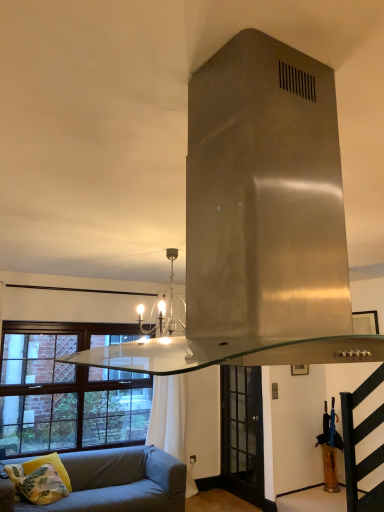
Question: From the image's perspective, is clear glass door at center positioned above or below yellow fabric pillow at lower left, arranged as the second pillow when viewed from the left?

Choices:
 (A) above
 (B) below

Answer: (B)

Question: From a real-world perspective, is clear glass door at center positioned above or below yellow fabric pillow at lower left, which is the first pillow from right to left?

Choices:
 (A) above
 (B) below

Answer: (A)

Question: Which of these objects is positioned farthest from the clear glass door at center?

Choices:
 (A) light blue fabric studio couch at lower left
 (B) brown wooden window at lower left
 (C) matte black chandelier at center
 (D) yellow floral pillow at lower left, marked as the 1th pillow in a left-to-right arrangement
 (E) yellow fabric pillow at lower left, arranged as the second pillow when viewed from the left

Answer: (D)

Question: Which object is the closest to the brown wooden window at lower left?

Choices:
 (A) light blue fabric studio couch at lower left
 (B) matte black chandelier at center
 (C) clear glass door at center
 (D) yellow floral pillow at lower left, marked as the second pillow in a right-to-left arrangement
 (E) yellow fabric pillow at lower left, arranged as the second pillow when viewed from the left

Answer: (A)